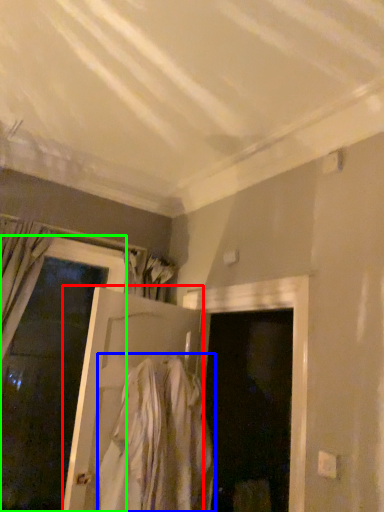
Question: Considering the real-world distances, which object is closest to door (highlighted by a red box)? clothing (highlighted by a blue box) or door (highlighted by a green box).

Choices:
 (A) clothing
 (B) door

Answer: (A)